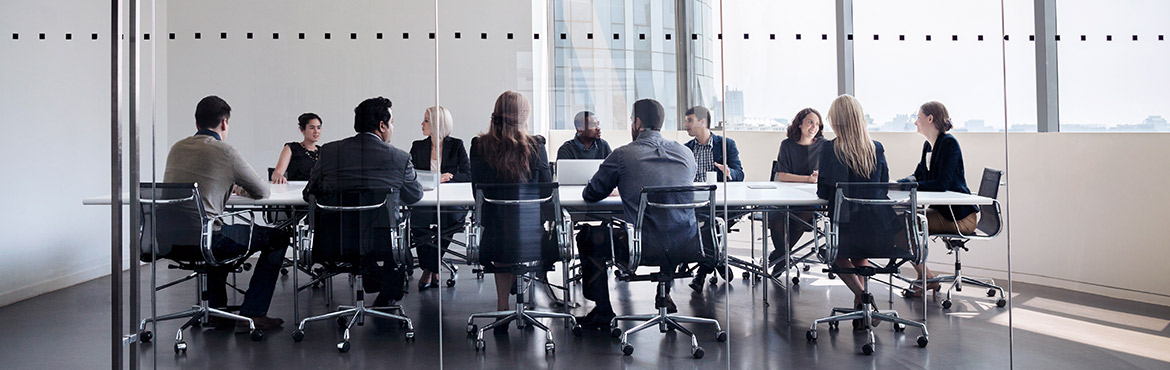
Where is `windows viewing the outside`? This screenshot has height=370, width=1170. windows viewing the outside is located at coordinates (1122, 79), (972, 72), (759, 82), (620, 66).